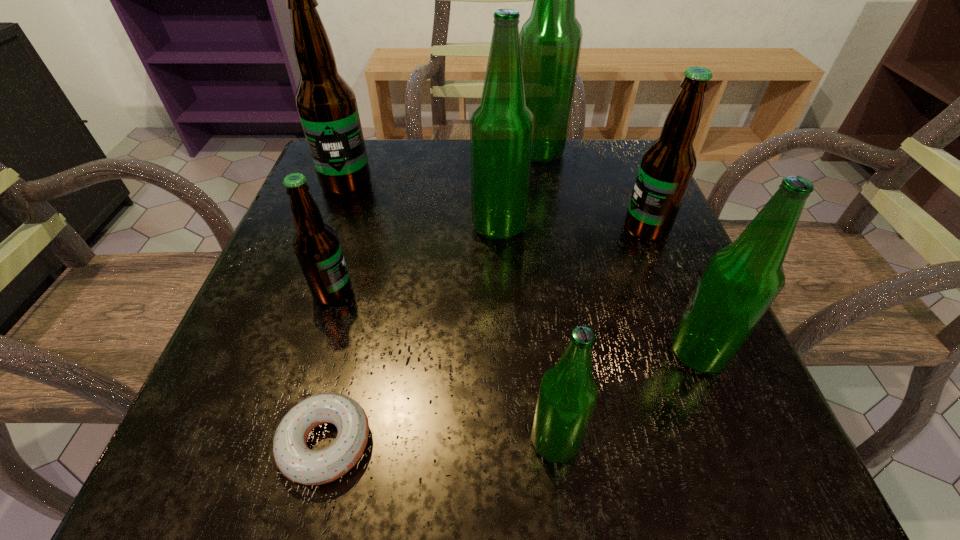
Where is `vacant region that satisfies the following two spatial constraints: 1. on the label of the tallest beer bottle; 2. on the label of the biggest brown beer bottle`? vacant region that satisfies the following two spatial constraints: 1. on the label of the tallest beer bottle; 2. on the label of the biggest brown beer bottle is located at coordinates (544, 184).

Locate an element on the screen. This screenshot has width=960, height=540. blank area in the image that satisfies the following two spatial constraints: 1. on the label of the shortest object; 2. on the right side of the fifth farthest beer bottle is located at coordinates (286, 443).